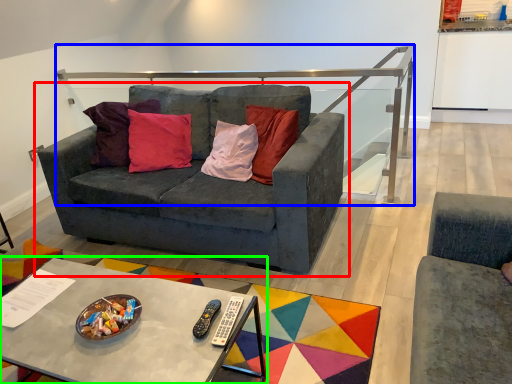
Question: Based on their relative distances, which object is farther from studio couch (highlighted by a red box)? Choose from balustrade (highlighted by a blue box) and coffee table (highlighted by a green box).

Choices:
 (A) balustrade
 (B) coffee table

Answer: (A)